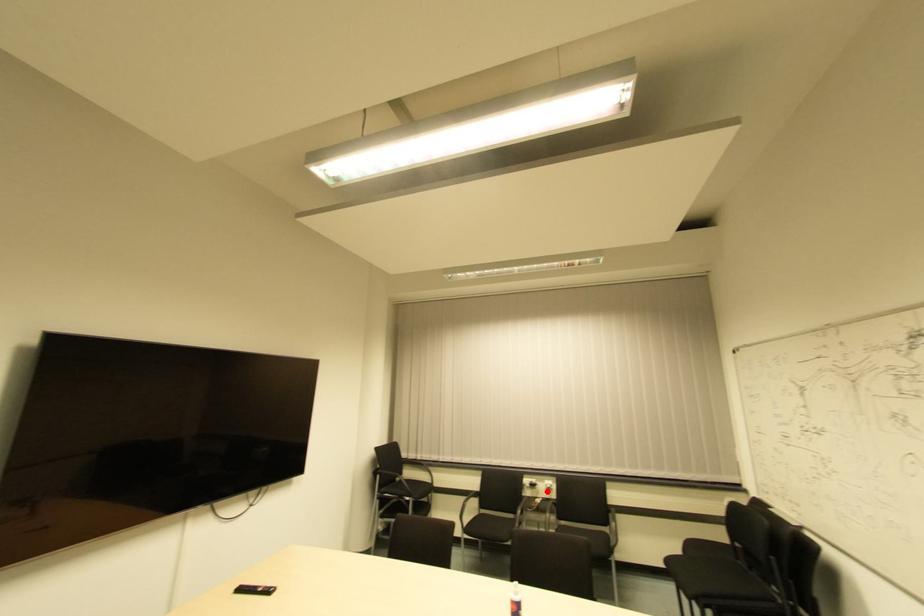
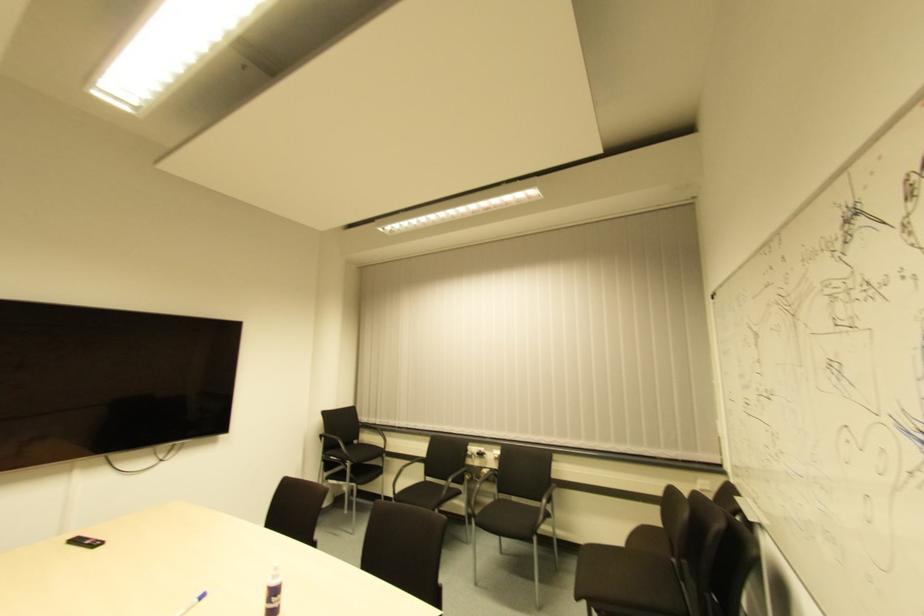
Question: I am providing you with two images of the same scene from different viewpoints. A red point is shown in image1. For the corresponding object point in image2, is it positioned nearer or farther from the camera?

Choices:
 (A) Nearer
 (B) Farther

Answer: (A)